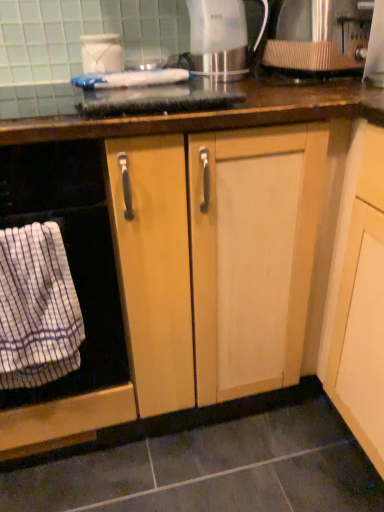
Question: Is white striped towel at left located within white striped cloth at left?

Choices:
 (A) no
 (B) yes

Answer: (A)

Question: From a real-world perspective, is white striped cloth at left under white striped towel at left?

Choices:
 (A) no
 (B) yes

Answer: (B)

Question: Does white striped cloth at left have a smaller size compared to white striped towel at left?

Choices:
 (A) no
 (B) yes

Answer: (B)

Question: Does white striped cloth at left come behind white striped towel at left?

Choices:
 (A) no
 (B) yes

Answer: (B)

Question: Is white striped cloth at left beside white striped towel at left?

Choices:
 (A) yes
 (B) no

Answer: (A)

Question: Considering their positions, is white striped cloth at left located in front of or behind metallic silver kettle at upper center, acting as the 2th kitchen appliance starting from the right?

Choices:
 (A) front
 (B) behind

Answer: (A)

Question: From a real-world perspective, relative to metallic silver kettle at upper center, acting as the 2th kitchen appliance starting from the right, is white striped cloth at left vertically above or below?

Choices:
 (A) above
 (B) below

Answer: (B)

Question: Does point (31, 352) appear closer or farther from the camera than point (198, 23)?

Choices:
 (A) farther
 (B) closer

Answer: (B)

Question: Is white striped cloth at left taller or shorter than metallic silver kettle at upper center, which ranks as the 2th kitchen appliance in left-to-right order?

Choices:
 (A) tall
 (B) short

Answer: (A)

Question: Is point (216, 7) closer or farther from the camera than point (41, 361)?

Choices:
 (A) closer
 (B) farther

Answer: (B)

Question: From a real-world perspective, relative to white striped cloth at left, is metallic silver kettle at upper center, which ranks as the 2th kitchen appliance in left-to-right order, vertically above or below?

Choices:
 (A) below
 (B) above

Answer: (B)

Question: Relative to white striped cloth at left, is metallic silver kettle at upper center, acting as the 2th kitchen appliance starting from the right, in front or behind?

Choices:
 (A) behind
 (B) front

Answer: (A)

Question: Is metallic silver kettle at upper center, acting as the 2th kitchen appliance starting from the right, taller or shorter than white striped cloth at left?

Choices:
 (A) tall
 (B) short

Answer: (B)

Question: From the image's perspective, relative to white striped towel at left, is white striped cloth at left above or below?

Choices:
 (A) above
 (B) below

Answer: (B)

Question: In terms of height, does white striped cloth at left look taller or shorter compared to white striped towel at left?

Choices:
 (A) tall
 (B) short

Answer: (B)